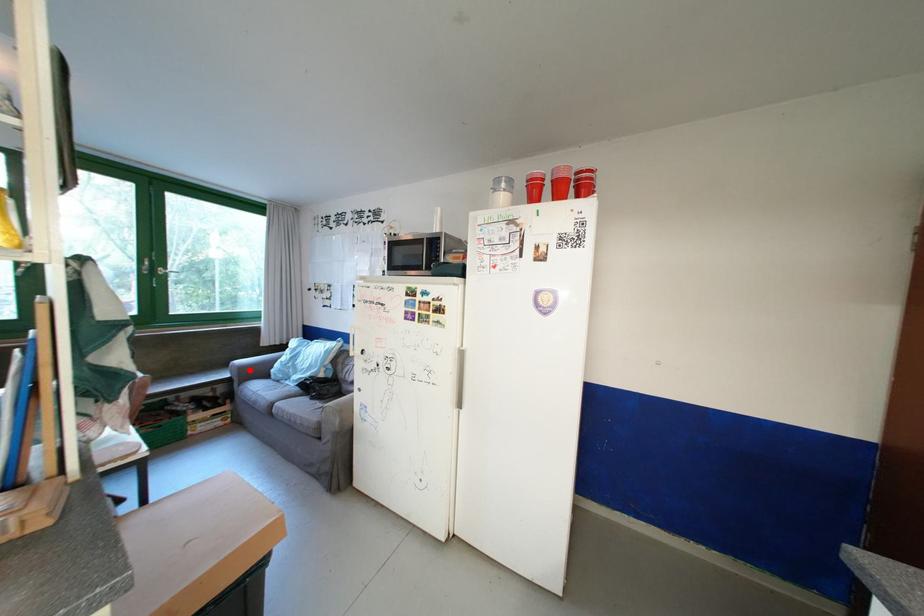
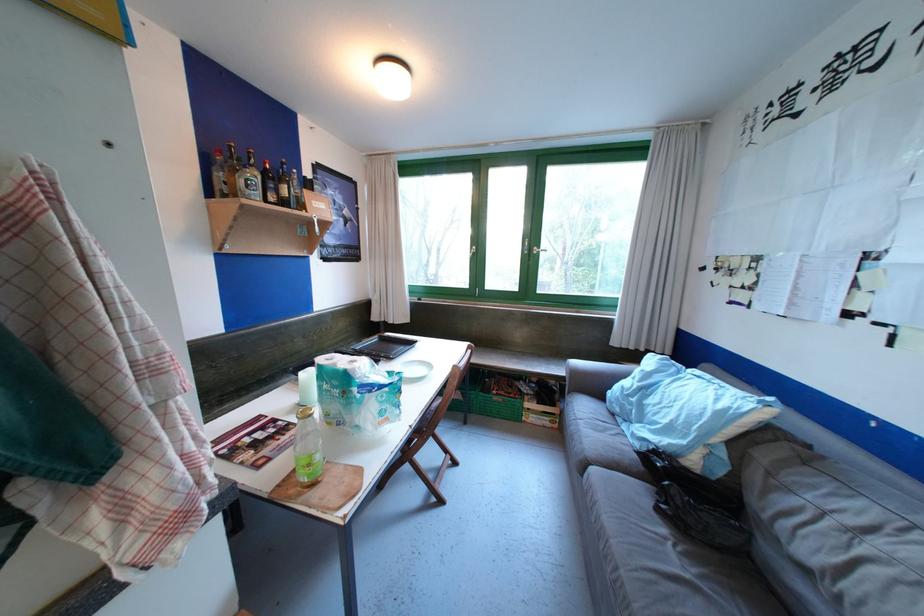
Where in the second image is the point corresponding to the highlighted location from the first image?

(581, 376)